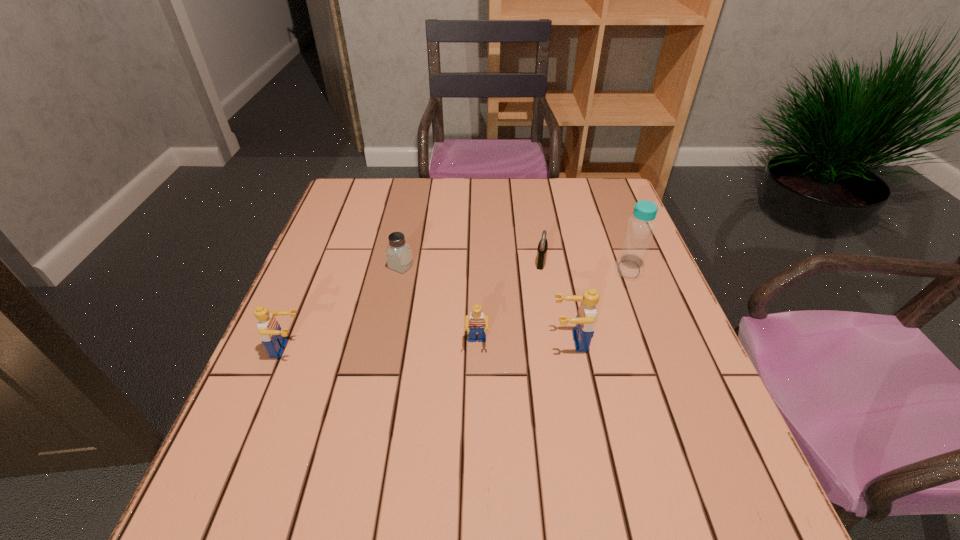
Choose which Lego is the nearest neighbor to the tallest object. Please provide its 2D coordinates. Your answer should be formatted as a tuple, i.e. [(x, y)], where the tuple contains the x and y coordinates of a point satisfying the conditions above.

[(585, 320)]

Locate which Lego is the closest to the shortest Lego. Please provide its 2D coordinates. Your answer should be formatted as a tuple, i.e. [(x, y)], where the tuple contains the x and y coordinates of a point satisfying the conditions above.

[(585, 320)]

I want to click on free location that satisfies the following two spatial constraints: 1. on the face of the second tallest object; 2. on the face of the third object from left to right, so click(571, 344).

Locate an element on the screen. The image size is (960, 540). free location that satisfies the following two spatial constraints: 1. on the face of the fifth shortest object; 2. on the face of the shortest Lego is located at coordinates (571, 344).

At what (x,y) coordinates should I click in order to perform the action: click on vacant region that satisfies the following two spatial constraints: 1. on the front side of the padlock; 2. on the face of the leftmost object. Please return your answer as a coordinate pair (x, y). This screenshot has width=960, height=540. Looking at the image, I should click on (555, 349).

The width and height of the screenshot is (960, 540). I want to click on vacant area in the image that satisfies the following two spatial constraints: 1. on the face of the tallest Lego; 2. on the face of the third object from left to right, so click(571, 344).

Find the location of a particular element. vacant space that satisfies the following two spatial constraints: 1. on the front side of the padlock; 2. on the face of the leftmost Lego is located at coordinates (555, 349).